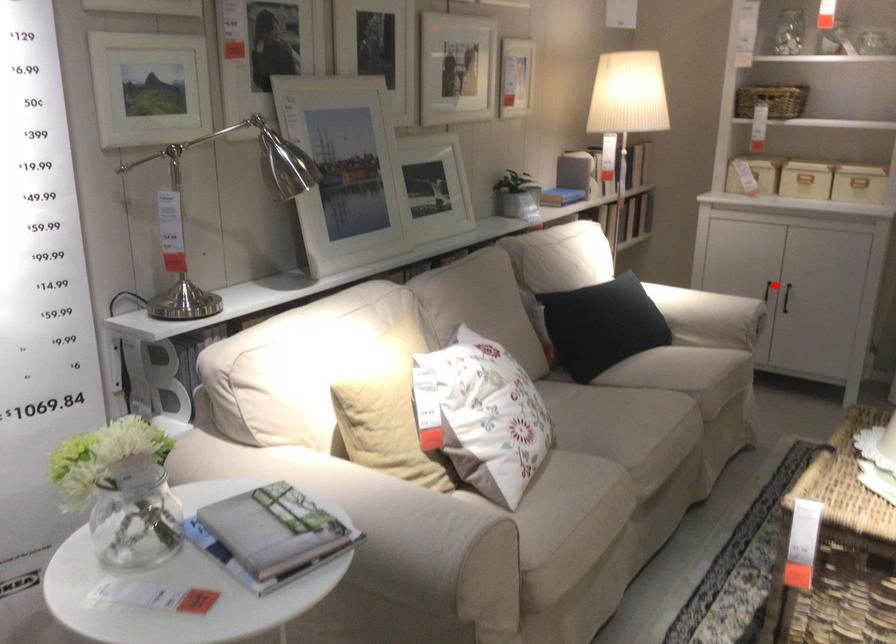
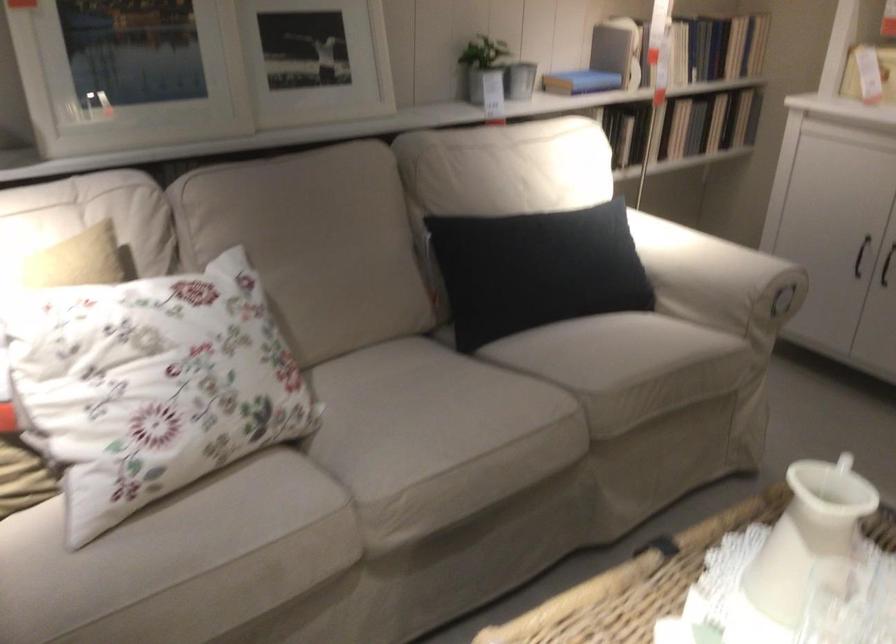
Find the pixel in the second image that matches the highlighted location in the first image.

(860, 256)